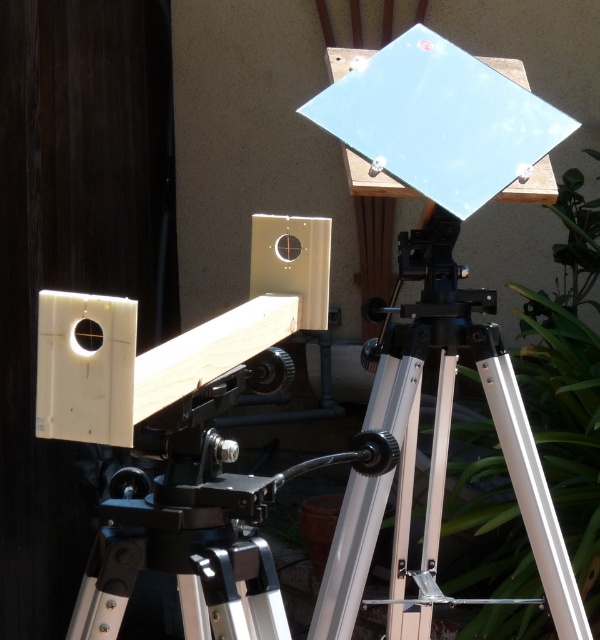
You are setting up a solar telescope and notice two components in the image. One is the silver metallic tripod at center and the other is the matte black lens at center. Which component is closer to you when you are standing in front of the setup?

The silver metallic tripod at center is closer to you since it is positioned further to the viewer than the matte black lens at center, meaning the tripod is nearer in the setup.